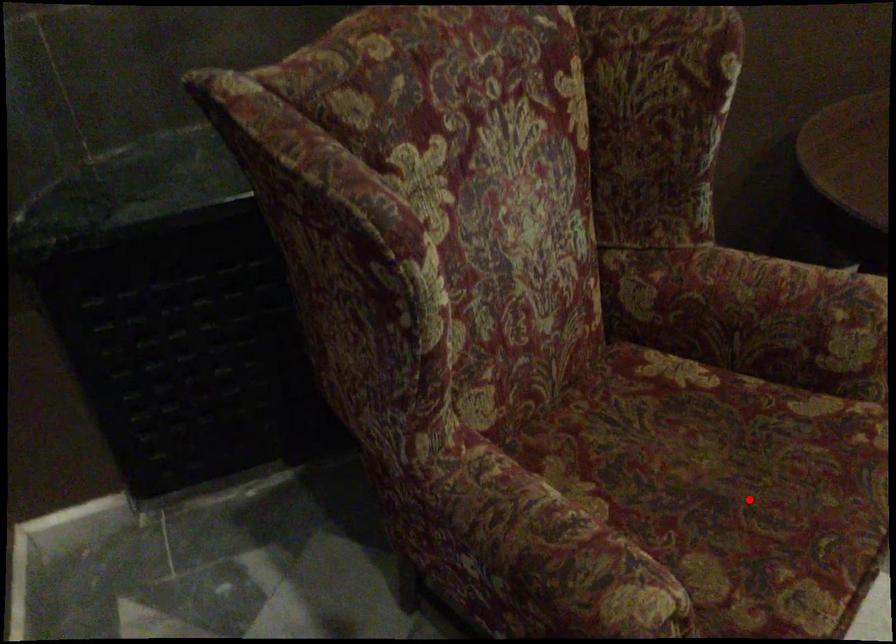
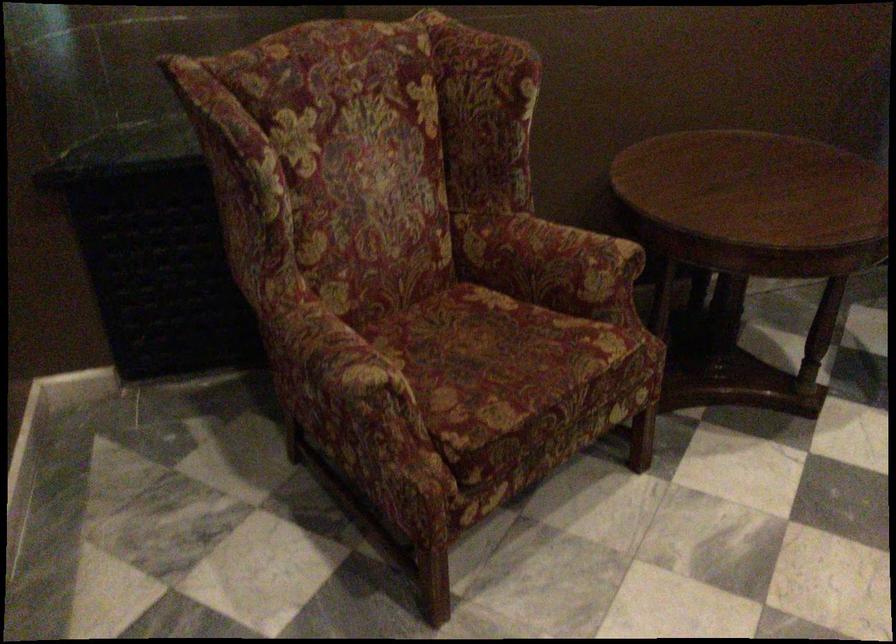
Question: A red point is marked in image1. In image2, is the corresponding 3D point closer to the camera or farther? Reply with the corresponding letter.

Choices:
 (A) The corresponding 3D point is closer.
 (B) The corresponding 3D point is farther.

Answer: (B)